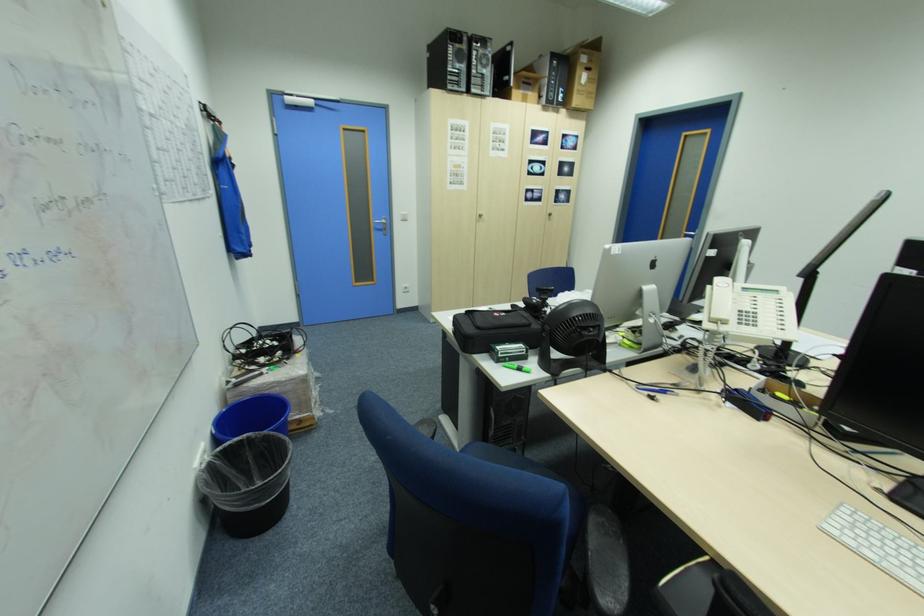
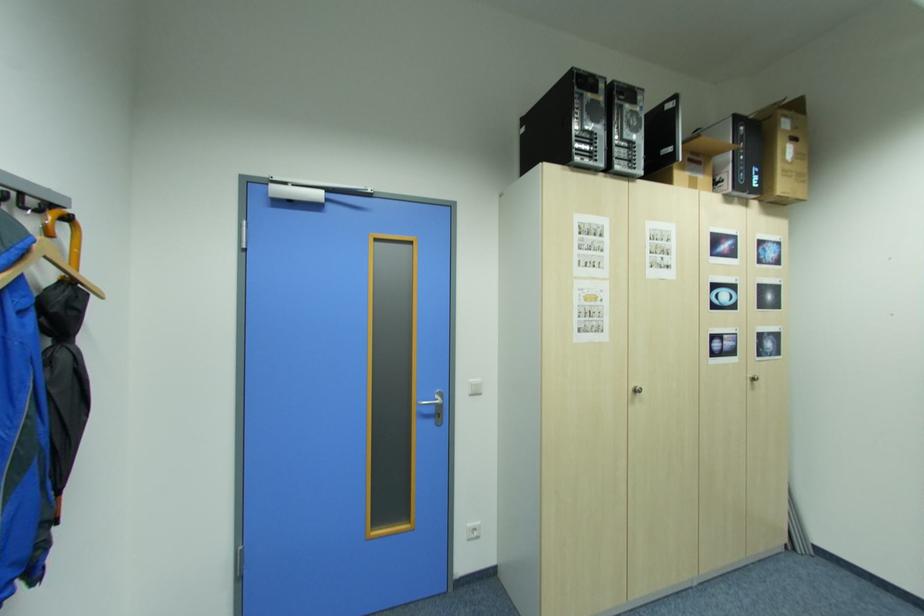
Where in the second image is the point corresponding to (387,235) from the first image?

(438, 424)